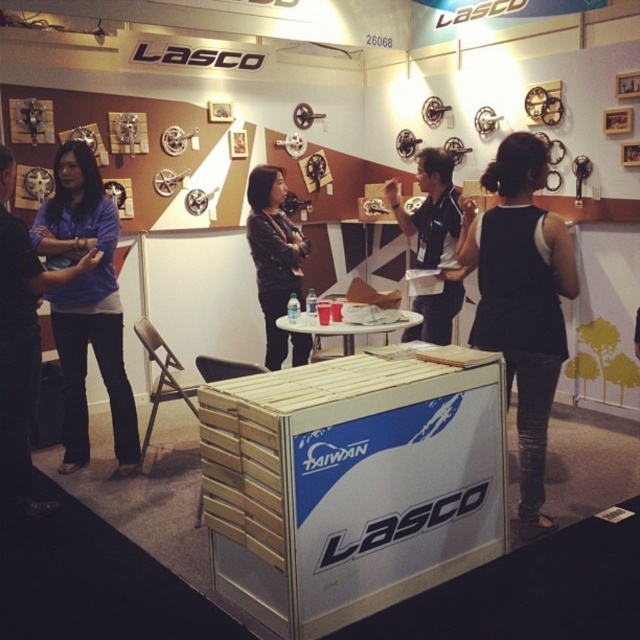
You are a photographer at the Lasco booth. You want to take a photo of the black shirt at center and the black leather jacket at center. Which one should you focus on first if you want to capture both clearly?

The black shirt at center is in front of the black leather jacket at center, so you should focus on the black shirt at center first to ensure both are in focus.

You are a fashion designer standing at the entrance of the booth. You want to check the distance between the black fabric dress at center and the matte blue shirt at left. Can you reach both items without moving your position if your arm span is 1.8 meters?

The black fabric dress at center is 2.27 meters away from the matte blue shirt at left. Since your arm span is 1.8 meters, you cannot reach both items without moving your position.